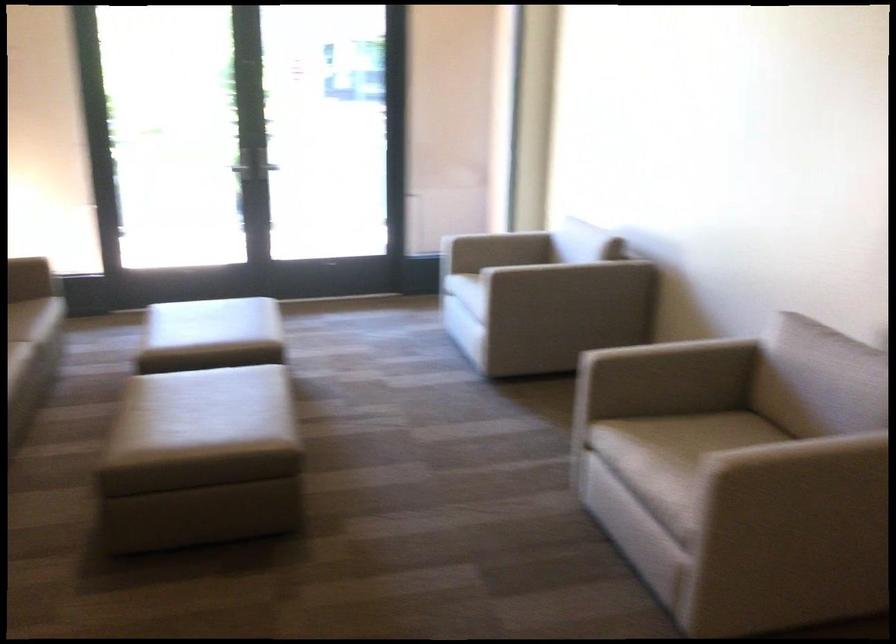
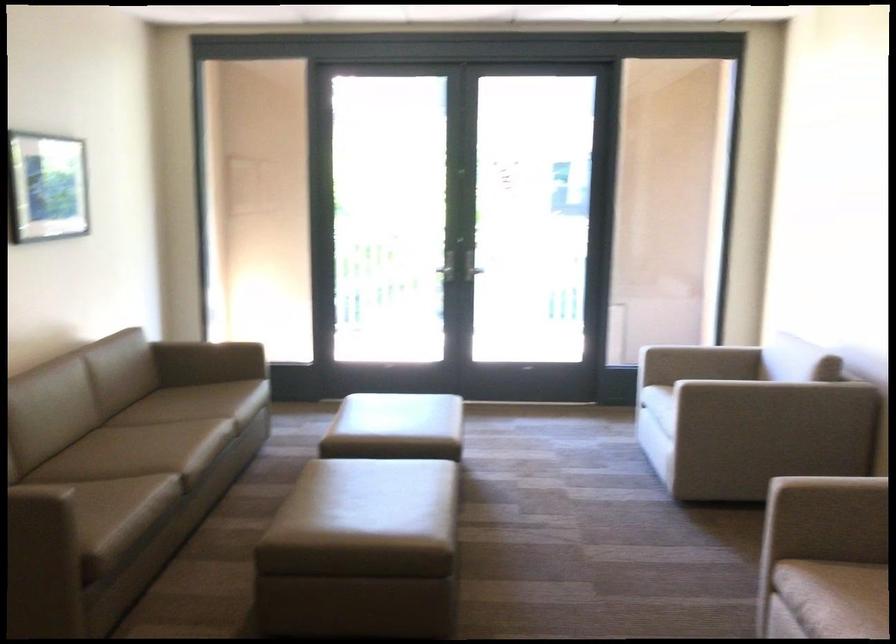
In the second image, find the point that corresponds to (565,267) in the first image.

(774, 392)